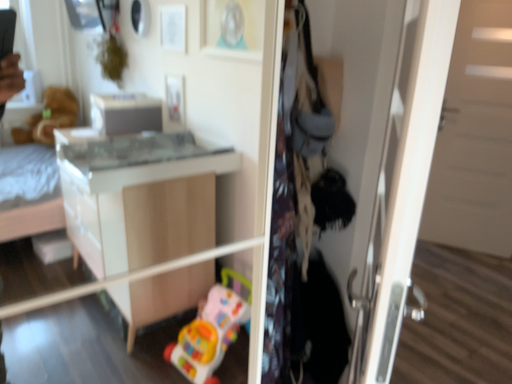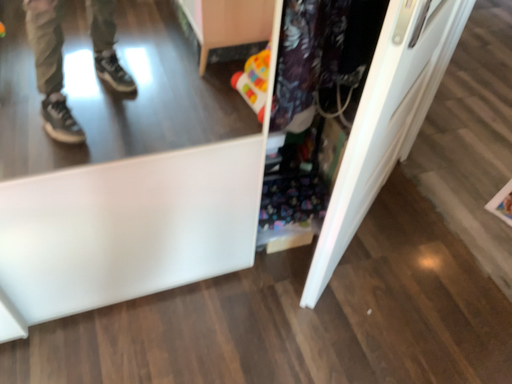
Question: How did the camera likely rotate when shooting the video?

Choices:
 (A) rotated downward
 (B) rotated upward

Answer: (A)